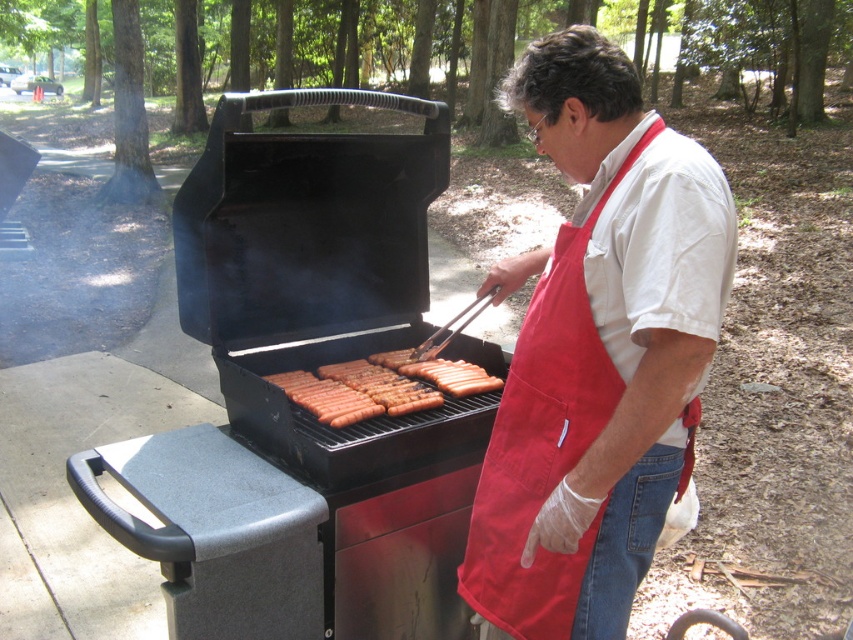
You are a food safety inspector checking the cooking process. You see the black matte barbecue grill at center and the brown matte hot dog at center. Which object is positioned higher in the image?

The black matte barbecue grill at center is positioned higher than the brown matte hot dog at center.

You are a drone operator trying to capture the best aerial shot of the black matte barbecue grill at center. The drone has a camera with a 100mm lens that can focus on objects at a distance of up to 10 meters. If the grill is located at point 0.631 on the x axis and 0.352 on the y axis in the coordinate system, can the drone capture a clear image of the grill from its current position?

The black matte barbecue grill at center is located at coordinates 0.631 on the x axis and 0.352 on the y axis. Since the drone can focus up to 10 meters away, and the coordinates are within the standard 0 to 1 range, the distance from the drone to the grill is well within the camera lens range. Therefore, the drone can capture a clear image of the black matte barbecue grill at center.

You are a safety inspector checking the grilling setup. The white cotton shirt at center and the brown matte hot dog at center are both in the central area. Based on their positions, which object is closer to the heat source from the grill?

The white cotton shirt at center is in front of the brown matte hot dog at center, meaning it is closer to the heat source from the grill.